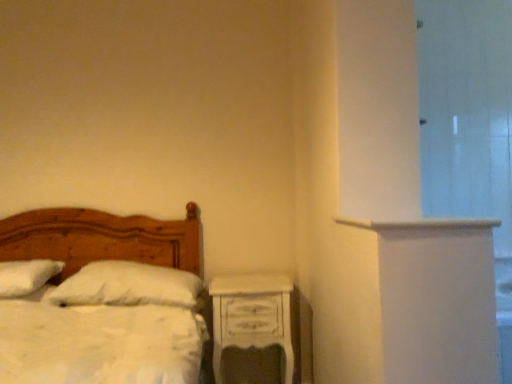
Question: From the image's perspective, is transparent glass door at right under white fluffy pillow at left, marked as the 1th pillow in a left-to-right arrangement?

Choices:
 (A) yes
 (B) no

Answer: (B)

Question: Can you confirm if transparent glass door at right is positioned to the right of white fluffy pillow at left, marked as the 1th pillow in a left-to-right arrangement?

Choices:
 (A) no
 (B) yes

Answer: (B)

Question: Does transparent glass door at right have a lesser height compared to white fluffy pillow at left, which ranks as the 2th pillow in right-to-left order?

Choices:
 (A) no
 (B) yes

Answer: (A)

Question: From the image's perspective, is transparent glass door at right above white fluffy pillow at left, marked as the 1th pillow in a left-to-right arrangement?

Choices:
 (A) yes
 (B) no

Answer: (A)

Question: Is transparent glass door at right not within white fluffy pillow at left, which ranks as the 2th pillow in right-to-left order?

Choices:
 (A) yes
 (B) no

Answer: (A)

Question: Could you tell me if transparent glass door at right is facing white fluffy pillow at left, which ranks as the 2th pillow in right-to-left order?

Choices:
 (A) no
 (B) yes

Answer: (A)

Question: From the image's perspective, is white fluffy pillow at left, which ranks as the 2th pillow in right-to-left order, beneath white soft pillow at center, arranged as the 1th pillow when viewed from the right?

Choices:
 (A) no
 (B) yes

Answer: (A)

Question: Can you confirm if white fluffy pillow at left, marked as the 1th pillow in a left-to-right arrangement, is thinner than white soft pillow at center, arranged as the 1th pillow when viewed from the right?

Choices:
 (A) no
 (B) yes

Answer: (A)

Question: Is white soft pillow at center, which ranks as the 2th pillow in left-to-right order, surrounded by white fluffy pillow at left, marked as the 1th pillow in a left-to-right arrangement?

Choices:
 (A) no
 (B) yes

Answer: (A)

Question: Is white fluffy pillow at left, marked as the 1th pillow in a left-to-right arrangement, turned away from white soft pillow at center, which ranks as the 2th pillow in left-to-right order?

Choices:
 (A) yes
 (B) no

Answer: (B)

Question: Can you confirm if white fluffy pillow at left, marked as the 1th pillow in a left-to-right arrangement, is taller than white soft pillow at center, arranged as the 1th pillow when viewed from the right?

Choices:
 (A) no
 (B) yes

Answer: (A)

Question: Does white fluffy pillow at left, which ranks as the 2th pillow in right-to-left order, come in front of white soft pillow at center, arranged as the 1th pillow when viewed from the right?

Choices:
 (A) yes
 (B) no

Answer: (A)

Question: Can you confirm if white fluffy pillow at left, marked as the 1th pillow in a left-to-right arrangement, is smaller than white painted wood ledge at upper right?

Choices:
 (A) yes
 (B) no

Answer: (B)